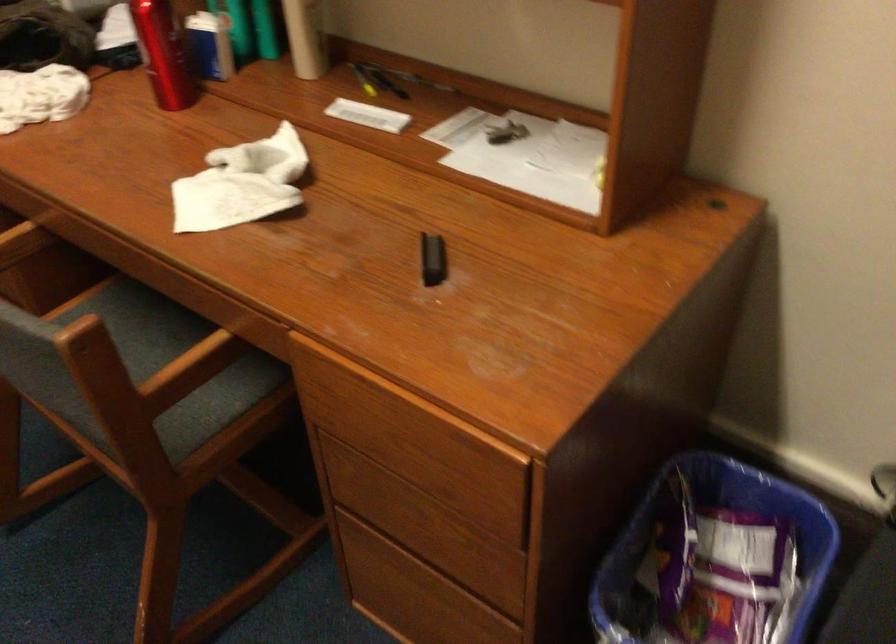
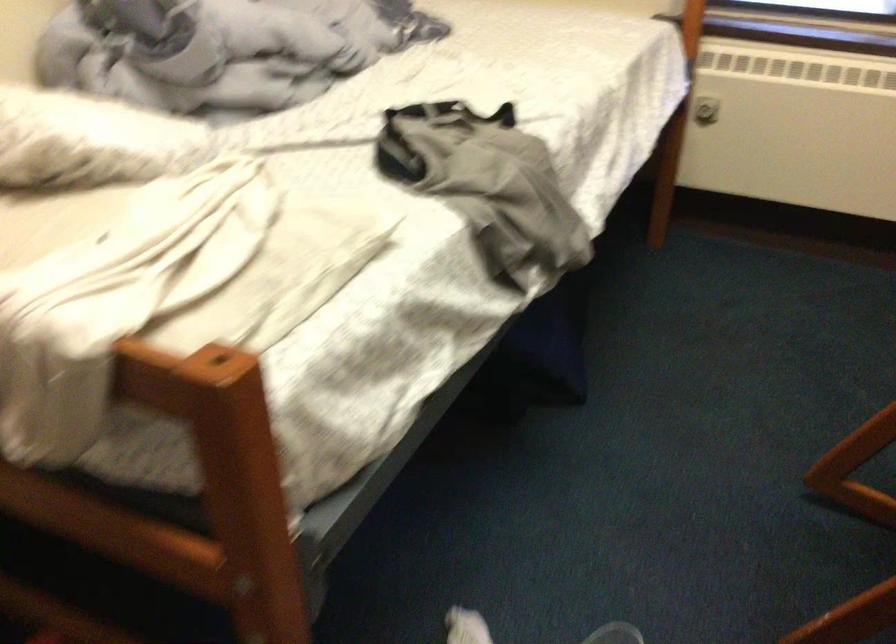
How did the camera likely rotate?

The camera rotated toward left-down.